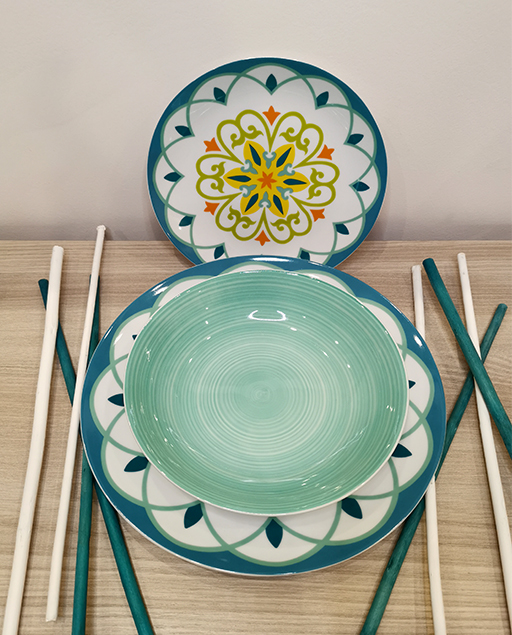
I want to click on chop sticks, so click(20, 505), click(60, 521), click(74, 524), click(112, 540), click(384, 573), click(429, 568), click(490, 479), click(497, 408).